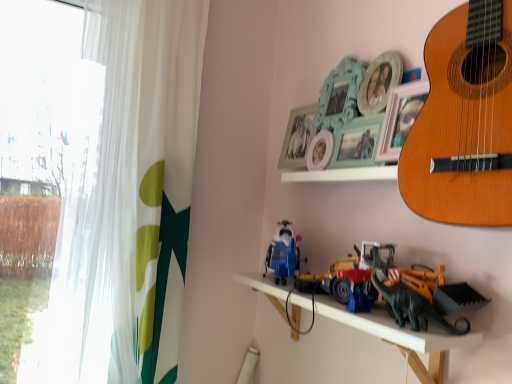
The height and width of the screenshot is (384, 512). Describe the element at coordinates (283, 254) in the screenshot. I see `blue plastic toy truck at center, the first toy positioned from the left` at that location.

What is the approximate width of light brown wooden guitar at upper right?

light brown wooden guitar at upper right is 7.38 inches in width.

The image size is (512, 384). What do you see at coordinates (37, 162) in the screenshot?
I see `transparent fabric at left` at bounding box center [37, 162].

The width and height of the screenshot is (512, 384). What do you see at coordinates (425, 298) in the screenshot?
I see `green matte dinosaur at lower right, which ranks as the second toy in left-to-right order` at bounding box center [425, 298].

Identify the location of yellow plastic construction vehicle at lower right, which ranks as the 1th toy in right-to-left order. The image size is (512, 384). (397, 288).

Between point (425, 166) and point (347, 173), which one is positioned behind?

The point (347, 173) is farther.

Is light brown wooden guitar at upper right looking in the opposite direction of white wooden shelf at upper center?

No, light brown wooden guitar at upper right is not facing the opposite direction of white wooden shelf at upper center.

Is light brown wooden guitar at upper right positioned far away from white wooden shelf at upper center?

light brown wooden guitar at upper right is near white wooden shelf at upper center, not far away.

From the image's perspective, is light brown wooden guitar at upper right located above or below white wooden shelf at upper center?

light brown wooden guitar at upper right is above white wooden shelf at upper center.

From the image's perspective, is blue plastic toy truck at center, the first toy positioned from the left, located beneath yellow plastic construction vehicle at lower right, which ranks as the 1th toy in right-to-left order?

Incorrect, from the image's perspective, blue plastic toy truck at center, the first toy positioned from the left, is higher than yellow plastic construction vehicle at lower right, which ranks as the 1th toy in right-to-left order.

Is blue plastic toy truck at center, the first toy positioned from the left, in front of or behind yellow plastic construction vehicle at lower right, the third toy viewed from the left, in the image?

blue plastic toy truck at center, the first toy positioned from the left, is behind yellow plastic construction vehicle at lower right, the third toy viewed from the left.

Considering the positions of objects blue plastic toy truck at center, positioned as the 3th toy in right-to-left order, and yellow plastic construction vehicle at lower right, which ranks as the 1th toy in right-to-left order, in the image provided, who is more to the right, blue plastic toy truck at center, positioned as the 3th toy in right-to-left order, or yellow plastic construction vehicle at lower right, which ranks as the 1th toy in right-to-left order,?

From the viewer's perspective, yellow plastic construction vehicle at lower right, which ranks as the 1th toy in right-to-left order, appears more on the right side.

Is transparent fabric at left to the left of blue plastic toy truck at center, the first toy positioned from the left, from the viewer's perspective?

Yes.

Can you confirm if transparent fabric at left is wider than blue plastic toy truck at center, positioned as the 3th toy in right-to-left order?

Correct, the width of transparent fabric at left exceeds that of blue plastic toy truck at center, positioned as the 3th toy in right-to-left order.

Considering the sizes of transparent fabric at left and blue plastic toy truck at center, the first toy positioned from the left, in the image, is transparent fabric at left taller or shorter than blue plastic toy truck at center, the first toy positioned from the left,?

Considering their sizes, transparent fabric at left has more height than blue plastic toy truck at center, the first toy positioned from the left.

Does point (40, 169) appear closer or farther from the camera than point (298, 237)?

Point (40, 169) is positioned farther from the camera compared to point (298, 237).

From a real-world perspective, which object rests below the other?

From a 3D spatial view, yellow plastic construction vehicle at lower right, the third toy viewed from the left, is below.

Looking at this image, in the image, is white wooden shelf at upper center on the left side or the right side of yellow plastic construction vehicle at lower right, the third toy viewed from the left?

From the image, it's evident that white wooden shelf at upper center is to the left of yellow plastic construction vehicle at lower right, the third toy viewed from the left.

Considering the points (367, 179) and (417, 312), which point is in front, point (367, 179) or point (417, 312)?

The point (417, 312) is closer to the camera.

Considering the relative sizes of white wooden shelf at upper center and light brown wooden guitar at upper right in the image provided, is white wooden shelf at upper center shorter than light brown wooden guitar at upper right?

Yes, white wooden shelf at upper center is shorter than light brown wooden guitar at upper right.

Does white wooden shelf at upper center contain light brown wooden guitar at upper right?

That's incorrect, light brown wooden guitar at upper right is not inside white wooden shelf at upper center.

Where is `window sill that is on the left side of light brown wooden guitar at upper right`? Image resolution: width=512 pixels, height=384 pixels. window sill that is on the left side of light brown wooden guitar at upper right is located at coordinates (343, 174).

Which of these two, white wooden shelf at upper center or light brown wooden guitar at upper right, is wider?

With larger width is light brown wooden guitar at upper right.

Considering the relative sizes of yellow plastic construction vehicle at lower right, the third toy viewed from the left, and green matte dinosaur at lower right, which is the second toy from right to left, in the image provided, is yellow plastic construction vehicle at lower right, the third toy viewed from the left, thinner than green matte dinosaur at lower right, which is the second toy from right to left,?

No.

From a real-world perspective, starting from the green matte dinosaur at lower right, which ranks as the second toy in left-to-right order, which toy is the 1st one vertically above it? Please provide its 2D coordinates.

[(397, 288)]

From a real-world perspective, who is located higher, yellow plastic construction vehicle at lower right, which ranks as the 1th toy in right-to-left order, or green matte dinosaur at lower right, which is the second toy from right to left?

yellow plastic construction vehicle at lower right, which ranks as the 1th toy in right-to-left order, is physically above.

Which of these two, blue plastic toy truck at center, positioned as the 3th toy in right-to-left order, or light brown wooden guitar at upper right, is thinner?

blue plastic toy truck at center, positioned as the 3th toy in right-to-left order.

Does point (287, 228) come closer to viewer compared to point (467, 188)?

No, (287, 228) is behind (467, 188).

Is blue plastic toy truck at center, positioned as the 3th toy in right-to-left order, taller than light brown wooden guitar at upper right?

In fact, blue plastic toy truck at center, positioned as the 3th toy in right-to-left order, may be shorter than light brown wooden guitar at upper right.

Would you say blue plastic toy truck at center, positioned as the 3th toy in right-to-left order, is inside or outside light brown wooden guitar at upper right?

blue plastic toy truck at center, positioned as the 3th toy in right-to-left order, cannot be found inside light brown wooden guitar at upper right.

Where is `window sill on the left of light brown wooden guitar at upper right`? This screenshot has width=512, height=384. window sill on the left of light brown wooden guitar at upper right is located at coordinates (343, 174).

Starting from the blue plastic toy truck at center, the first toy positioned from the left, which toy is the 2nd one to the right? Please provide its 2D coordinates.

[(397, 288)]

Which object lies further to the anchor point light brown wooden guitar at upper right, metallic plastic toys at center or transparent fabric at left?

Among the two, transparent fabric at left is located further to light brown wooden guitar at upper right.

Which object lies nearer to the anchor point white wooden shelf at upper center, metallic plastic toys at center or blue plastic toy truck at center, the first toy positioned from the left?

blue plastic toy truck at center, the first toy positioned from the left, is positioned closer to the anchor white wooden shelf at upper center.

Which object lies further to the anchor point transparent fabric at left, green matte dinosaur at lower right, which is the second toy from right to left, or white sheer curtain at left?

green matte dinosaur at lower right, which is the second toy from right to left, is further to transparent fabric at left.

Which object lies further to the anchor point light brown wooden guitar at upper right, blue plastic toy truck at center, the first toy positioned from the left, or green matte dinosaur at lower right, which is the second toy from right to left?

blue plastic toy truck at center, the first toy positioned from the left, is positioned further to the anchor light brown wooden guitar at upper right.

Estimate the real-world distances between objects in this image. Which object is closer to green matte dinosaur at lower right, which ranks as the second toy in left-to-right order, white sheer curtain at left or light brown wooden guitar at upper right?

Among the two, light brown wooden guitar at upper right is located nearer to green matte dinosaur at lower right, which ranks as the second toy in left-to-right order.

Looking at this image, looking at the image, which one is located further to metallic plastic toys at center, white sheer curtain at left or light brown wooden guitar at upper right?

Among the two, white sheer curtain at left is located further to metallic plastic toys at center.

From the image, which object appears to be farther from yellow plastic construction vehicle at lower right, the third toy viewed from the left, green matte dinosaur at lower right, which is the second toy from right to left, or white sheer curtain at left?

The object further to yellow plastic construction vehicle at lower right, the third toy viewed from the left, is white sheer curtain at left.

Looking at the image, which one is located closer to yellow plastic construction vehicle at lower right, the third toy viewed from the left, metallic plastic toys at center or transparent fabric at left?

metallic plastic toys at center.

The image size is (512, 384). Identify the location of window sill located between white sheer curtain at left and light brown wooden guitar at upper right in the left-right direction. (343, 174).

Identify the location of curtain between transparent fabric at left and light brown wooden guitar at upper right from left to right. (127, 196).

I want to click on toy between transparent fabric at left and white wooden shelf at upper center from left to right, so click(283, 254).

The image size is (512, 384). What are the coordinates of `shelf situated between white sheer curtain at left and green matte dinosaur at lower right, which ranks as the second toy in left-to-right order, from left to right` in the screenshot? It's located at (402, 337).